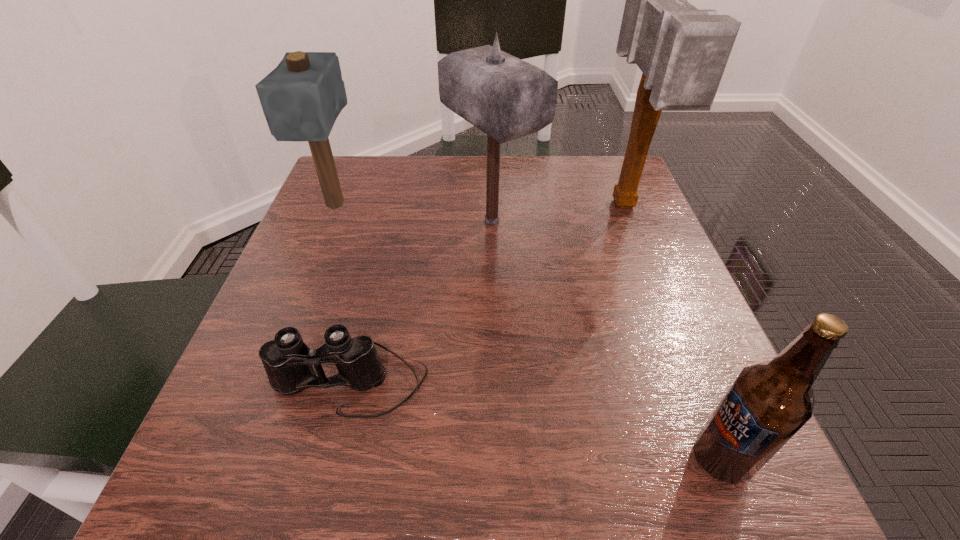
This screenshot has width=960, height=540. I want to click on empty space between the leftmost mallet and the third object from right to left, so click(x=414, y=213).

You are a GUI agent. You are given a task and a screenshot of the screen. Output one action in this format:
    pyautogui.click(x=<x>, y=<y>)
    Task: Click on the free space between the binoculars and the rightmost mallet
    This screenshot has width=960, height=540.
    Given the screenshot: What is the action you would take?
    pyautogui.click(x=487, y=294)

Identify the location of free space that is in between the nearest object and the rightmost mallet. This screenshot has width=960, height=540. (672, 332).

This screenshot has width=960, height=540. Find the location of `free area in between the rightmost mallet and the leftmost mallet`. free area in between the rightmost mallet and the leftmost mallet is located at coordinates (480, 206).

This screenshot has height=540, width=960. Find the location of `empty location between the leftmost mallet and the shortest object`. empty location between the leftmost mallet and the shortest object is located at coordinates (343, 294).

Locate an element on the screen. Image resolution: width=960 pixels, height=540 pixels. empty space that is in between the leftmost mallet and the third object from left to right is located at coordinates (414, 213).

I want to click on vacant area that lies between the leftmost mallet and the second nearest object, so click(343, 294).

At what (x,y) coordinates should I click in order to perform the action: click on vacant area between the shortest object and the leftmost mallet. Please return your answer as a coordinate pair (x, y). The height and width of the screenshot is (540, 960). Looking at the image, I should click on (343, 294).

Locate an element on the screen. Image resolution: width=960 pixels, height=540 pixels. unoccupied area between the binoculars and the third object from right to left is located at coordinates (420, 301).

The width and height of the screenshot is (960, 540). What are the coordinates of `the closest object relative to the third object from left to right` in the screenshot? It's located at (682, 51).